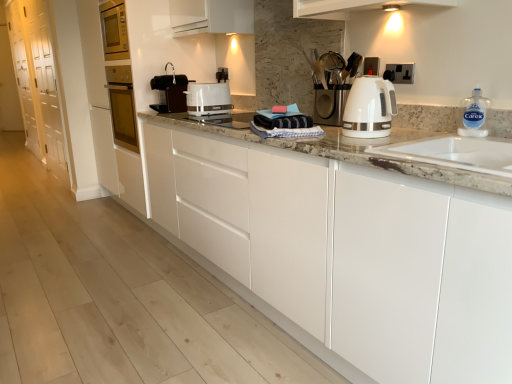
This screenshot has height=384, width=512. I want to click on vacant space in front of clear plastic bottle at right, so click(482, 140).